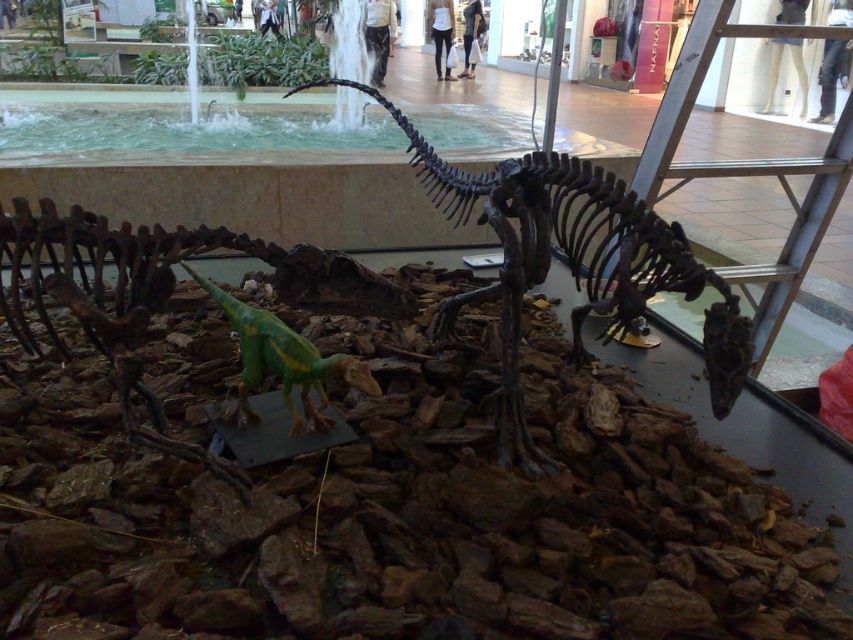
Can you confirm if brown metallic skeleton at center is positioned to the left of green matte plastic dinosaur at center?

Incorrect, brown metallic skeleton at center is not on the left side of green matte plastic dinosaur at center.

Is brown metallic skeleton at center shorter than green matte plastic dinosaur at center?

No.

Locate an element on the screen. brown metallic skeleton at center is located at coordinates (572, 260).

You are a GUI agent. You are given a task and a screenshot of the screen. Output one action in this format:
    pyautogui.click(x=<x>, y=<y>)
    Task: Click on the brown metallic skeleton at center
    The height and width of the screenshot is (640, 853).
    Given the screenshot: What is the action you would take?
    pyautogui.click(x=572, y=260)

Where is `brown metallic skeleton at center`? brown metallic skeleton at center is located at coordinates (572, 260).

Does brown metallic skeleton at center come in front of metallic silver ladder at right?

Yes, it is in front of metallic silver ladder at right.

Is point (732, 346) in front of point (786, 248)?

Yes, point (732, 346) is closer to viewer.

I want to click on brown metallic skeleton at center, so click(572, 260).

Who is positioned more to the left, metallic silver ladder at right or green matte plastic dinosaur at center?

From the viewer's perspective, green matte plastic dinosaur at center appears more on the left side.

Between metallic silver ladder at right and green matte plastic dinosaur at center, which one is positioned higher?

metallic silver ladder at right is higher up.

You are a GUI agent. You are given a task and a screenshot of the screen. Output one action in this format:
    pyautogui.click(x=<x>, y=<y>)
    Task: Click on the metallic silver ladder at right
    Image resolution: width=853 pixels, height=640 pixels.
    Given the screenshot: What is the action you would take?
    pyautogui.click(x=747, y=164)